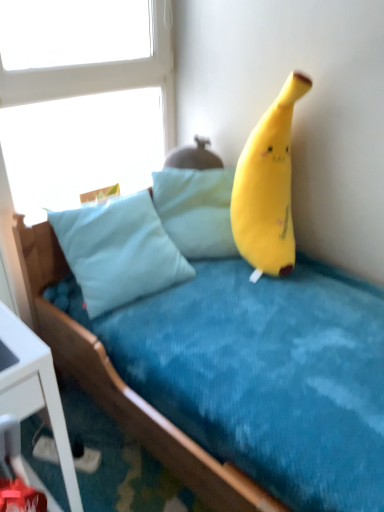
Consider the image. In order to face soft yellow plush at upper right, should I rotate leftwards or rightwards?

A 10.564 degree turn to the right will do.

You are a GUI agent. You are given a task and a screenshot of the screen. Output one action in this format:
    pyautogui.click(x=<x>, y=<y>)
    Task: Click on the soft blue fabric bed at upper right
    
    Given the screenshot: What is the action you would take?
    pyautogui.click(x=227, y=377)

The image size is (384, 512). What do you see at coordinates (227, 377) in the screenshot? I see `soft blue fabric bed at upper right` at bounding box center [227, 377].

The image size is (384, 512). Identify the location of white glass window at upper left. (84, 111).

Considering the sizes of objects white glass window at upper left and light blue fabric pillow at center in the image provided, who is wider, white glass window at upper left or light blue fabric pillow at center?

With larger width is light blue fabric pillow at center.

Is point (65, 115) behind point (166, 182)?

No, (65, 115) is in front of (166, 182).

Can you confirm if white glass window at upper left is shorter than light blue fabric pillow at center?

No, white glass window at upper left is not shorter than light blue fabric pillow at center.

From the image's perspective, is soft blue fabric bed at upper right located beneath light blue fabric pillow at center?

Correct, soft blue fabric bed at upper right appears lower than light blue fabric pillow at center in the image.

Does soft blue fabric bed at upper right have a lesser height compared to light blue fabric pillow at center?

In fact, soft blue fabric bed at upper right may be taller than light blue fabric pillow at center.

Is soft blue fabric bed at upper right spatially inside light blue fabric pillow at center, or outside of it?

soft blue fabric bed at upper right is located beyond the bounds of light blue fabric pillow at center.

Which object is further away from the camera taking this photo, soft blue fabric bed at upper right or soft yellow plush at upper right?

Positioned behind is soft yellow plush at upper right.

Is soft blue fabric bed at upper right looking in the opposite direction of soft yellow plush at upper right?

That's not correct — soft blue fabric bed at upper right is not looking away from soft yellow plush at upper right.

In order to click on bed on the left of soft yellow plush at upper right in this screenshot , I will do `click(227, 377)`.

Which of these two, soft yellow plush at upper right or light blue fabric pillow at center, is wider?

soft yellow plush at upper right is wider.

From a real-world perspective, is soft yellow plush at upper right above or below light blue fabric pillow at center?

In terms of real-world spatial position, soft yellow plush at upper right is above light blue fabric pillow at center.

From the image's perspective, would you say soft yellow plush at upper right is positioned over light blue fabric pillow at center?

Correct, soft yellow plush at upper right appears higher than light blue fabric pillow at center in the image.

Is soft yellow plush at upper right bigger than light blue fabric pillow at center?

Indeed, soft yellow plush at upper right has a larger size compared to light blue fabric pillow at center.

Is soft blue fabric bed at upper right located outside white glass window at upper left?

Indeed, soft blue fabric bed at upper right is completely outside white glass window at upper left.

How different are the orientations of soft blue fabric bed at upper right and white glass window at upper left in degrees?

They differ by 0.000466 degrees in their facing directions.

Between soft blue fabric bed at upper right and white glass window at upper left, which one has more height?

white glass window at upper left is taller.

Considering the positions of objects soft blue fabric bed at upper right and white glass window at upper left in the image provided, who is more to the left, soft blue fabric bed at upper right or white glass window at upper left?

white glass window at upper left.

Is white glass window at upper left inside light blue fabric pillow at center?

No, white glass window at upper left is not inside light blue fabric pillow at center.

Between light blue fabric pillow at center and white glass window at upper left, which one is positioned in front?

white glass window at upper left is in front.

Is point (186, 232) farther from viewer compared to point (98, 117)?

No, it is in front of (98, 117).

Can you confirm if light blue fabric pillow at center is taller than white glass window at upper left?

Incorrect, the height of light blue fabric pillow at center is not larger of that of white glass window at upper left.

Is soft yellow plush at upper right touching white glass window at upper left?

They are not placed beside each other.

Can you tell me how much soft yellow plush at upper right and white glass window at upper left differ in facing direction?

soft yellow plush at upper right and white glass window at upper left are facing 40.3 degrees away from each other.

Can you confirm if soft yellow plush at upper right is thinner than white glass window at upper left?

No, soft yellow plush at upper right is not thinner than white glass window at upper left.

Is soft yellow plush at upper right taller or shorter than white glass window at upper left?

In the image, soft yellow plush at upper right appears to be shorter than white glass window at upper left.

Where is `pillow below the white glass window at upper left (from the image's perspective)`? The image size is (384, 512). pillow below the white glass window at upper left (from the image's perspective) is located at coordinates (196, 210).

This screenshot has width=384, height=512. I want to click on bed in front of the light blue fabric pillow at center, so click(x=227, y=377).

Considering their positions, is soft blue fabric bed at upper right positioned closer to light blue fabric pillow at center than soft yellow plush at upper right?

soft yellow plush at upper right lies closer to light blue fabric pillow at center than the other object.

Looking at the image, which one is located closer to white glass window at upper left, soft yellow plush at upper right or soft blue fabric bed at upper right?

soft yellow plush at upper right lies closer to white glass window at upper left than the other object.

When comparing their distances from soft yellow plush at upper right, does white glass window at upper left or light blue fabric pillow at center seem further?

Among the two, white glass window at upper left is located further to soft yellow plush at upper right.

Looking at the image, which one is located further to soft blue fabric bed at upper right, soft yellow plush at upper right or white glass window at upper left?

white glass window at upper left is further to soft blue fabric bed at upper right.

When comparing their distances from soft blue fabric bed at upper right, does soft yellow plush at upper right or light blue fabric pillow at center seem closer?

Based on the image, light blue fabric pillow at center appears to be nearer to soft blue fabric bed at upper right.

Which object lies further to the anchor point light blue fabric pillow at center, soft yellow plush at upper right or white glass window at upper left?

Based on the image, white glass window at upper left appears to be further to light blue fabric pillow at center.

From the picture: Looking at the image, which one is located further to soft blue fabric bed at upper right, white glass window at upper left or light blue fabric pillow at center?

white glass window at upper left lies further to soft blue fabric bed at upper right than the other object.

Estimate the real-world distances between objects in this image. Which object is closer to white glass window at upper left, soft yellow plush at upper right or light blue fabric pillow at center?

light blue fabric pillow at center.

Locate an element on the screen. Image resolution: width=384 pixels, height=512 pixels. banana between soft blue fabric bed at upper right and light blue fabric pillow at center along the z-axis is located at coordinates (267, 187).

In order to click on window between soft blue fabric bed at upper right and light blue fabric pillow at center from front to back in this screenshot , I will do `click(84, 111)`.

Identify the location of banana between white glass window at upper left and soft blue fabric bed at upper right in the vertical direction. This screenshot has width=384, height=512. (267, 187).

The width and height of the screenshot is (384, 512). In order to click on pillow between white glass window at upper left and soft yellow plush at upper right from left to right in this screenshot , I will do `click(196, 210)`.